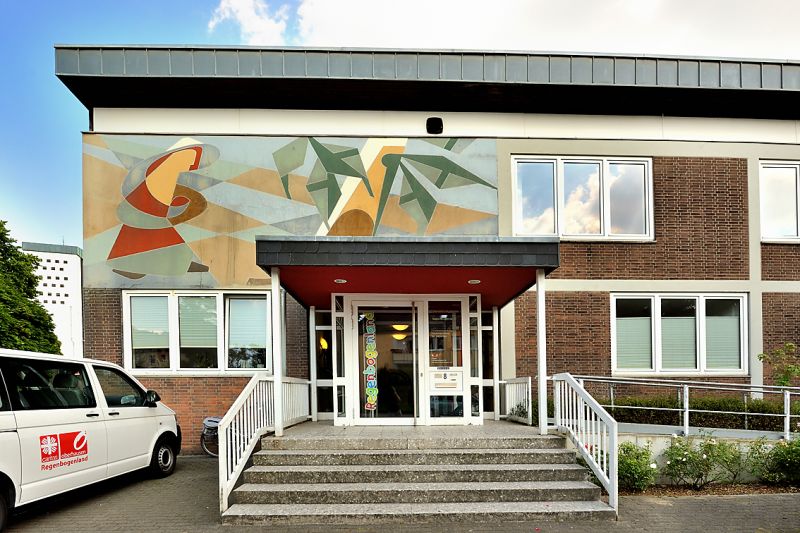
I want to click on window blinds, so click(x=149, y=317), click(x=200, y=319), click(x=244, y=323), click(x=633, y=343), click(x=674, y=340), click(x=720, y=348).